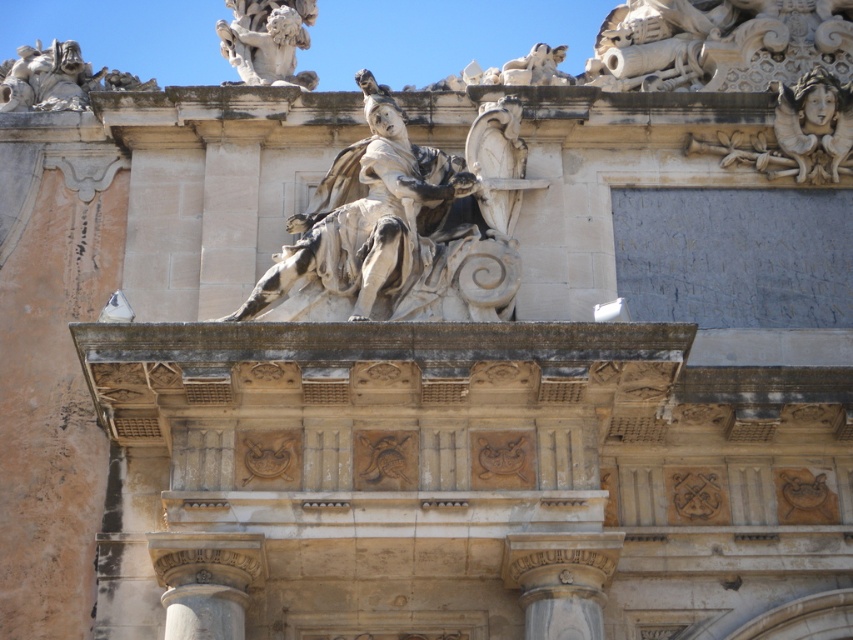
From the picture: You are an architect examining the facade and need to locate the smooth stone column at lower left. What are its coordinates?

The smooth stone column at lower left is located at coordinates point (206, 580).

You are an architect analyzing the facade and want to determine the spatial relationship between two points marked on the structure. Which of the two points, point 1 at coordinates point (548, 580) or point 2 at coordinates point (257, 29), is positioned closer to the observer?

Point 1 at coordinates point (548, 580) is closer to the observer than point 2 at coordinates point (257, 29).

You are an architect analyzing the structural integrity of the facade. The white marble column at center is crucial for supporting the roof. To ensure stability, the column must be positioned at the exact center of the facade. Is the column at the correct position?

The white marble column at center is positioned at point (561, 580), which is not the exact center of the facade. Therefore, the column is not positioned correctly for optimal structural support.